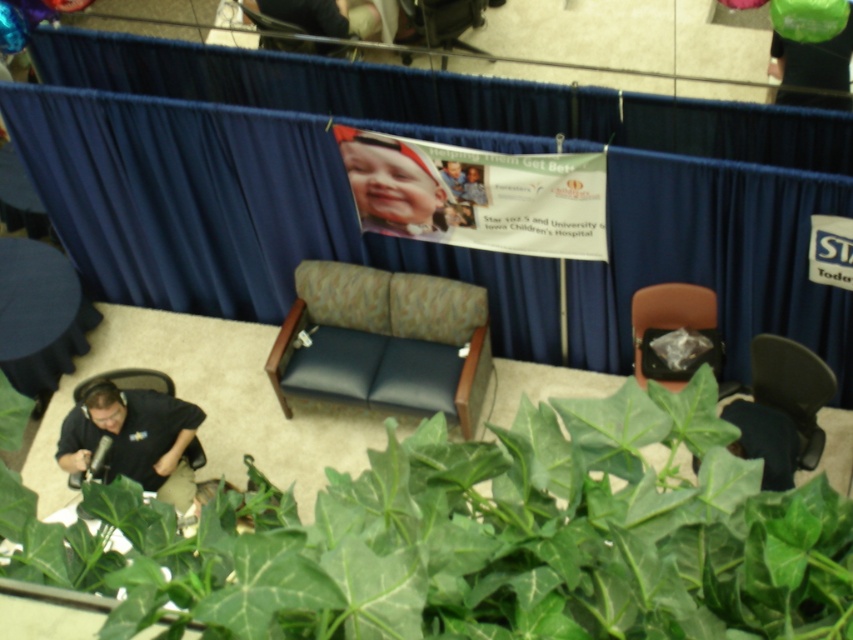
Question: Does matte black bag at right have a larger size compared to smooth plastic face at upper center?

Choices:
 (A) yes
 (B) no

Answer: (A)

Question: Based on their relative distances, which object is farther from the green leafy plant at lower left?

Choices:
 (A) dark blue leather armchair at center
 (B) black fabric armchair at lower right
 (C) black matte shirt at lower left

Answer: (A)

Question: Is the position of black fabric armchair at lower right less distant than that of smooth skin baby at upper center?

Choices:
 (A) yes
 (B) no

Answer: (A)

Question: Which of the following is the closest to the observer?

Choices:
 (A) (465, 182)
 (B) (181, 417)
 (C) (671, 296)
 (D) (395, 182)

Answer: (B)

Question: Which is nearer to the smooth plastic face at upper center?

Choices:
 (A) smooth skin baby at upper center
 (B) green leafy plant at lower left

Answer: (A)

Question: Does dark blue leather armchair at center have a smaller size compared to matte black bag at right?

Choices:
 (A) no
 (B) yes

Answer: (A)